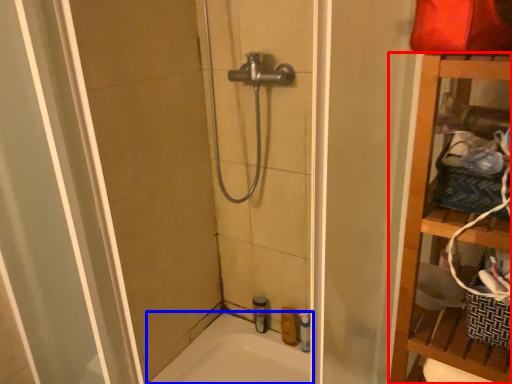
Question: Among these objects, which one is farthest to the camera, furniture (highlighted by a red box) or bathtub (highlighted by a blue box)?

Choices:
 (A) furniture
 (B) bathtub

Answer: (B)